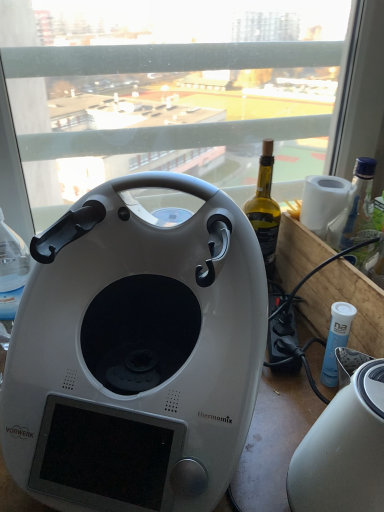
Question: Is transparent glass window at center positioned beyond the bounds of white glossy toaster at lower right?

Choices:
 (A) yes
 (B) no

Answer: (A)

Question: From a real-world perspective, is transparent glass window at center positioned under white glossy toaster at lower right based on gravity?

Choices:
 (A) yes
 (B) no

Answer: (B)

Question: Considering the relative positions of transparent glass window at center and white glossy toaster at lower right in the image provided, is transparent glass window at center behind white glossy toaster at lower right?

Choices:
 (A) no
 (B) yes

Answer: (B)

Question: Does transparent glass window at center appear on the left side of white glossy toaster at lower right?

Choices:
 (A) yes
 (B) no

Answer: (A)

Question: From the image's perspective, is transparent glass window at center below white glossy toaster at lower right?

Choices:
 (A) no
 (B) yes

Answer: (A)

Question: Is transparent glass window at center shorter than white glossy toaster at lower right?

Choices:
 (A) yes
 (B) no

Answer: (B)

Question: Can you confirm if white glossy toaster at lower right is shorter than white glossy thermomix at center?

Choices:
 (A) no
 (B) yes

Answer: (B)

Question: Is white glossy toaster at lower right outside white glossy thermomix at center?

Choices:
 (A) yes
 (B) no

Answer: (A)

Question: Can you confirm if white glossy toaster at lower right is bigger than white glossy thermomix at center?

Choices:
 (A) no
 (B) yes

Answer: (A)

Question: Is white glossy toaster at lower right positioned far away from white glossy thermomix at center?

Choices:
 (A) no
 (B) yes

Answer: (A)

Question: From a real-world perspective, is white glossy toaster at lower right under white glossy thermomix at center?

Choices:
 (A) no
 (B) yes

Answer: (B)

Question: From a real-world perspective, is white glossy toaster at lower right physically above white glossy thermomix at center?

Choices:
 (A) no
 (B) yes

Answer: (A)

Question: Considering the relative sizes of white glossy thermomix at center and transparent glass window at center in the image provided, is white glossy thermomix at center shorter than transparent glass window at center?

Choices:
 (A) no
 (B) yes

Answer: (B)